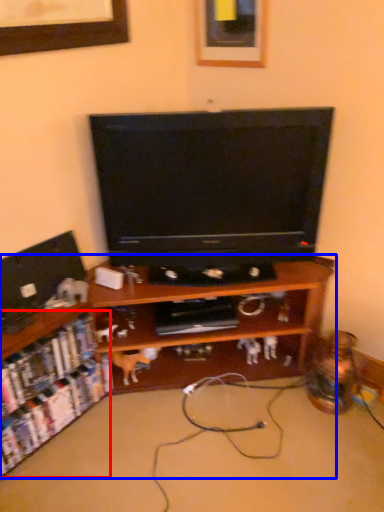
Question: Among these objects, which one is farthest to the camera, shelf (highlighted by a red box) or shelf (highlighted by a blue box)?

Choices:
 (A) shelf
 (B) shelf

Answer: (A)